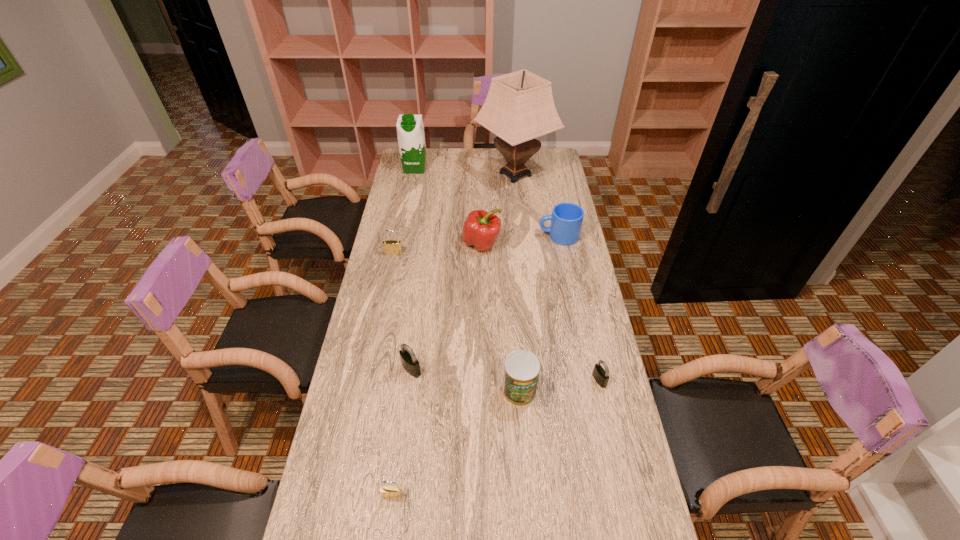
Image resolution: width=960 pixels, height=540 pixels. What are the coordinates of `vacant region located on the side of the mug with the handle` in the screenshot? It's located at (473, 236).

Where is `blank space located 0.360m on the front-facing side of the farthest padlock`? The image size is (960, 540). blank space located 0.360m on the front-facing side of the farthest padlock is located at coordinates (379, 326).

Locate an element on the screen. The height and width of the screenshot is (540, 960). vacant space located 0.170m on the right of the bigger black padlock is located at coordinates (476, 369).

This screenshot has width=960, height=540. I want to click on blank space located 0.170m on the left of the rightmost padlock, so click(x=539, y=380).

Where is `lampshade that is at the far edge`? lampshade that is at the far edge is located at coordinates (519, 107).

Locate an element on the screen. This screenshot has width=960, height=540. soya milk at the far edge is located at coordinates (410, 129).

This screenshot has height=540, width=960. I want to click on soya milk at the left edge, so click(x=410, y=129).

The image size is (960, 540). I want to click on lampshade located at the right edge, so click(519, 107).

Locate an element on the screen. The width and height of the screenshot is (960, 540). mug that is at the right edge is located at coordinates (566, 219).

The height and width of the screenshot is (540, 960). Identify the location of padlock present at the right edge. (600, 375).